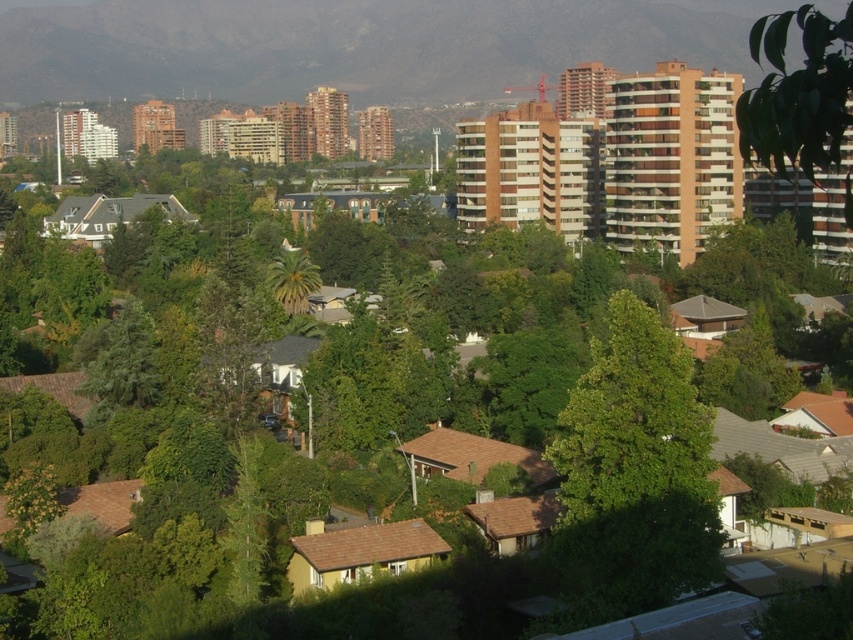
You are a landscape architect designing a new park in this suburban area. You need to decide where to plant a row of new trees. Considering the existing green leafy hillside at upper center and the green leafy tree at center, which one is wider and should be considered for spacing purposes?

The green leafy hillside at upper center is wider than the green leafy tree at center, so it should be considered for spacing purposes.

You are a landscape architect reviewing this suburban area. You need to determine which of the two green elements, the green leafy hillside at upper center or the green leafy tree at upper right, is shorter. Based on the provided image, which one is shorter?

The green leafy hillside at upper center is shorter than the green leafy tree at upper right.

You are standing in the suburban area looking at the green leafy tree at center. If you want to reach the tree quickly, should you walk forward or backward?

Since the green leafy tree at center is 56.33 meters away from the viewer, you should walk forward to reach it quickly.